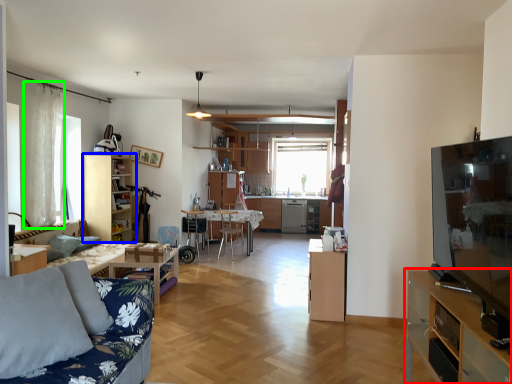
Question: Which object is positioned farthest from cabinetry (highlighted by a red box)? Select from cabinetry (highlighted by a blue box) and curtain (highlighted by a green box).

Choices:
 (A) cabinetry
 (B) curtain

Answer: (A)